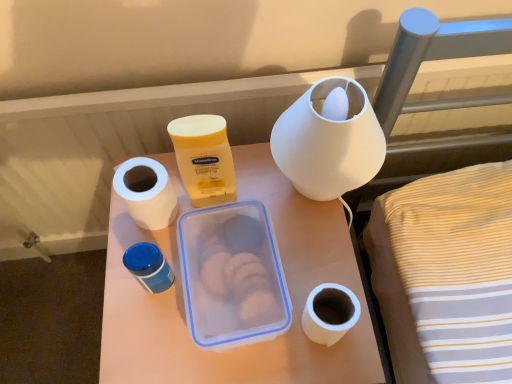
What are the coordinates of `free space in front of white matte lampshade at upper center, which is counted as the 2th pottery, starting from the bottom` in the screenshot? It's located at (321, 283).